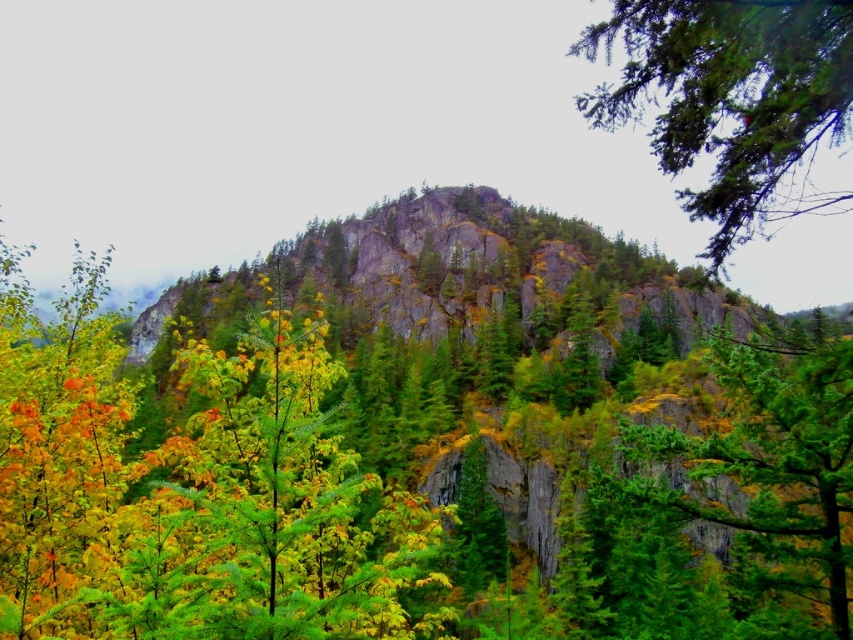
You are an artist planning to paint this landscape. You want to ensure the green textured branch at upper right and the green textured rock at right are proportionally accurate. Which object should you draw wider in your painting?

The green textured branch at upper right should be drawn wider because its width surpasses the green textured rock at right.

You are a hiker who wants to cross from the green textured branch at upper right to the green textured rock at right. Given that your hiking pole is 2 meters long, can you use it to reach the rock from the branch?

The distance between the green textured branch at upper right and the green textured rock at right is 32.02 meters, which is much longer than the 2 meters of your hiking pole. Therefore, you cannot reach the rock from the branch using the pole.

You are an artist sketching the landscape and want to draw the green textured branch at upper right and the green textured rock at right. Which object is located more to the right side of the other?

The green textured branch at upper right is positioned on the right side of the green textured rock at right, so the branch is more to the right compared to the rock.